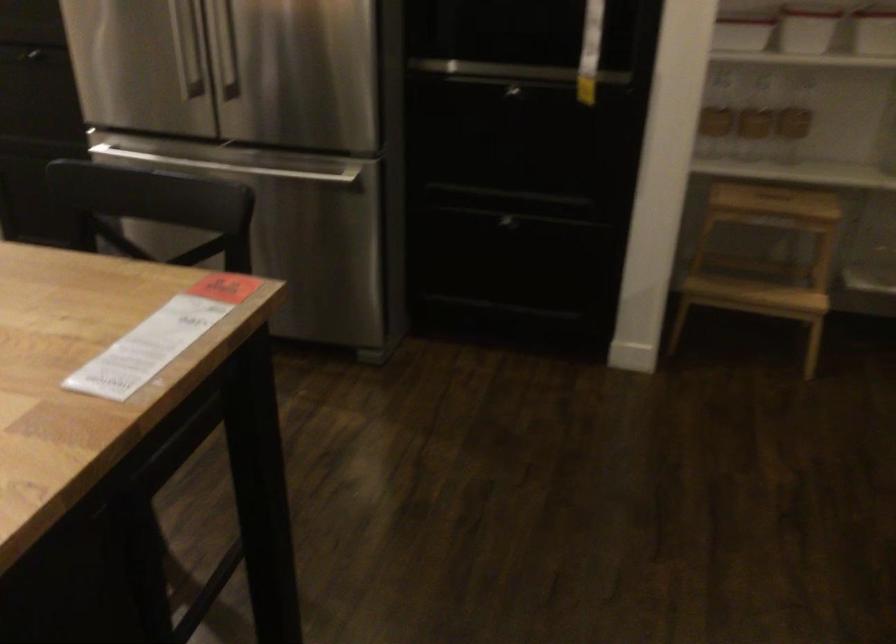
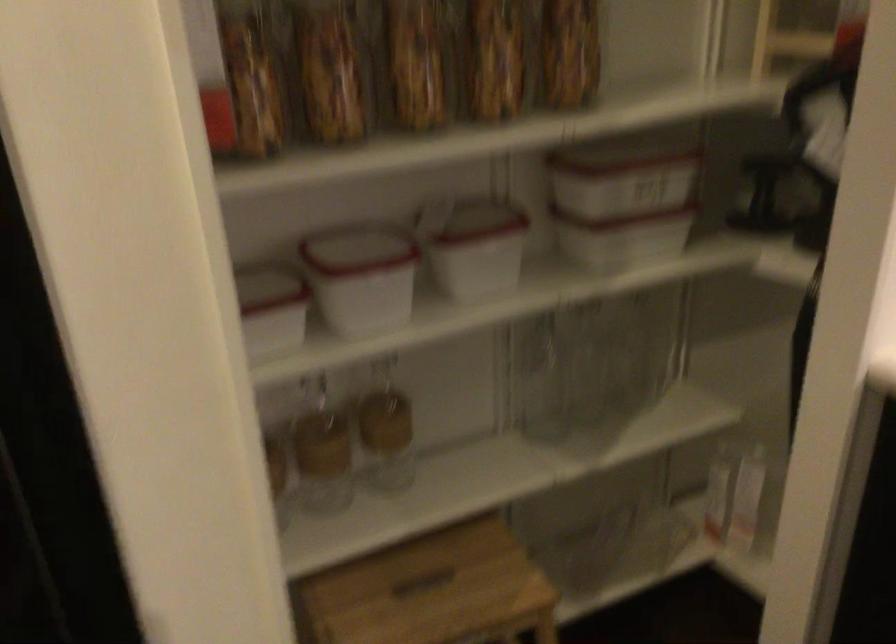
Where in the second image is the point corresponding to point 763,111 from the first image?

(322, 451)